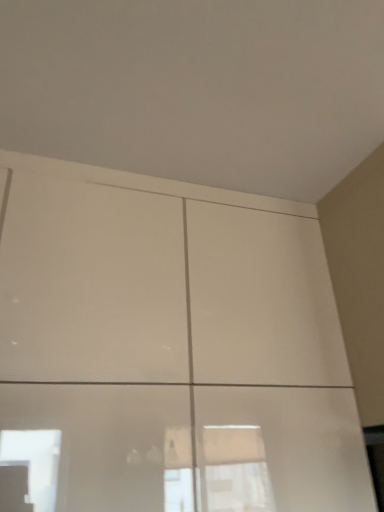
Image resolution: width=384 pixels, height=512 pixels. What do you see at coordinates (169, 348) in the screenshot? I see `white glossy cupboard at center` at bounding box center [169, 348].

Find the location of a particular element. This screenshot has width=384, height=512. white glossy cupboard at center is located at coordinates pos(169,348).

Locate an element on the screen. Image resolution: width=384 pixels, height=512 pixels. white glossy cupboard at center is located at coordinates (169, 348).